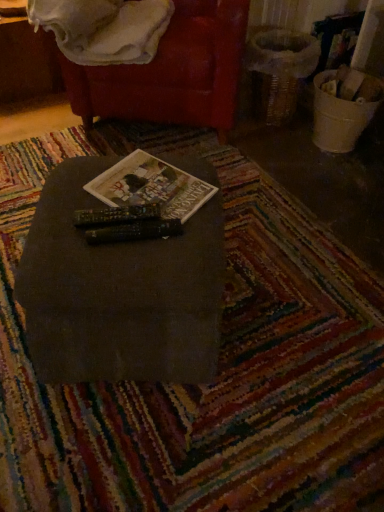
Identify the location of free space in front of hardcover book at center. The image size is (384, 512). tap(137, 261).